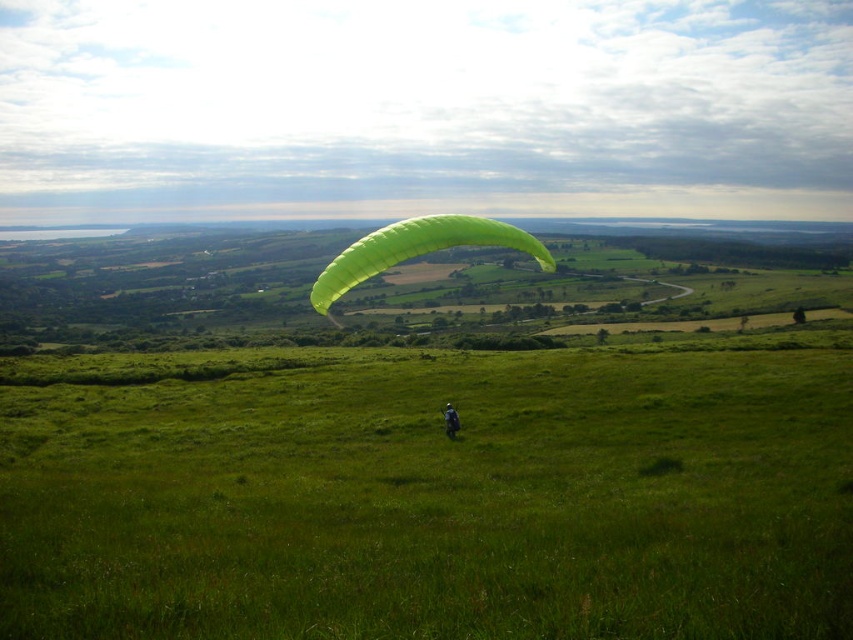
Question: Among these objects, which one is farthest from the camera?

Choices:
 (A) green matte parachute at center
 (B) green grassy field at center

Answer: (A)

Question: Is the position of green grassy field at center more distant than that of green matte parachute at center?

Choices:
 (A) yes
 (B) no

Answer: (B)

Question: Which point is closer to the camera taking this photo?

Choices:
 (A) (457, 424)
 (B) (479, 221)

Answer: (B)

Question: Which point is closer to the camera taking this photo?

Choices:
 (A) (552, 616)
 (B) (451, 410)
 (C) (376, 232)

Answer: (A)

Question: In this image, where is green grassy field at center located relative to green matte parachute at center?

Choices:
 (A) below
 (B) above

Answer: (A)

Question: Is green matte parachute at center closer to camera compared to green fabric paraglider at center?

Choices:
 (A) no
 (B) yes

Answer: (B)